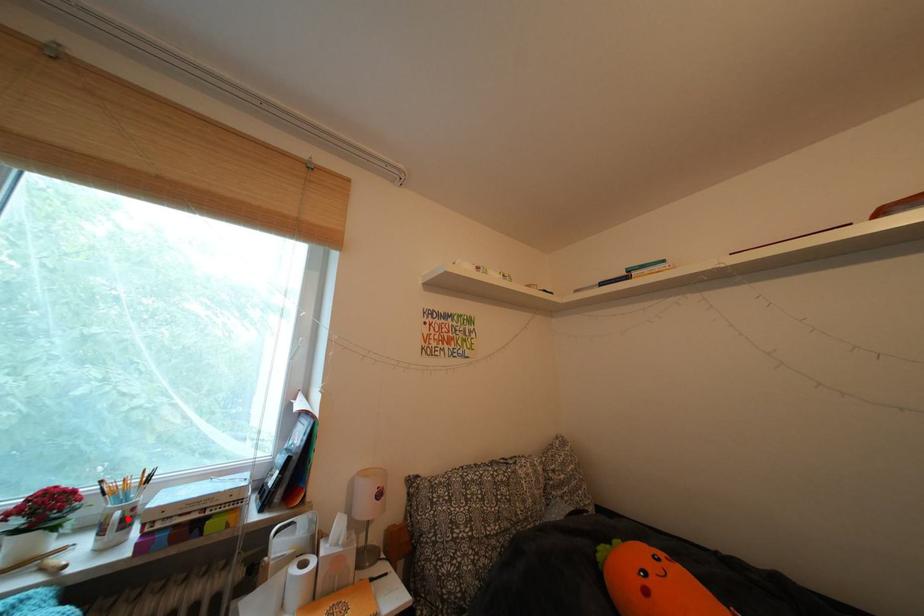
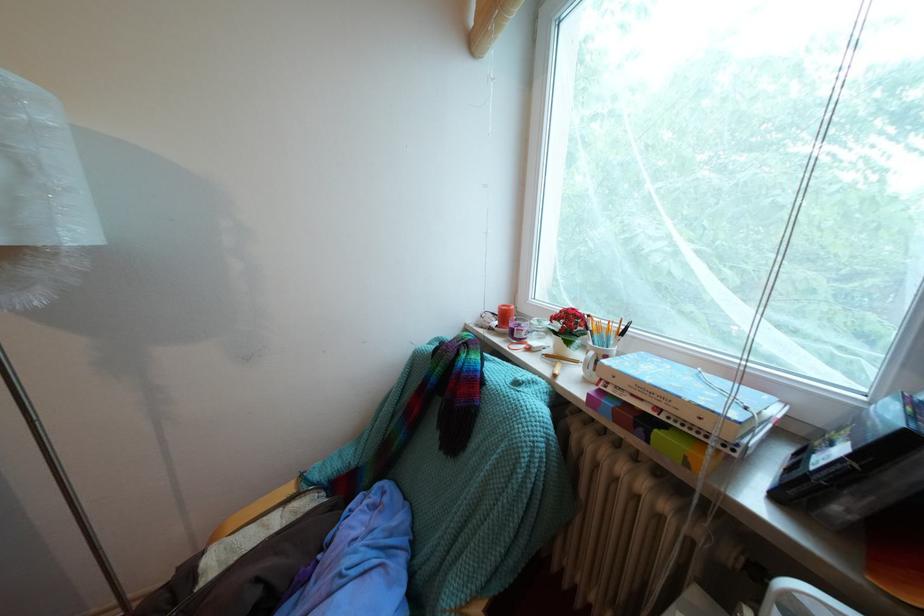
Find the pixel in the second image that matches the highlighted location in the first image.

(602, 359)